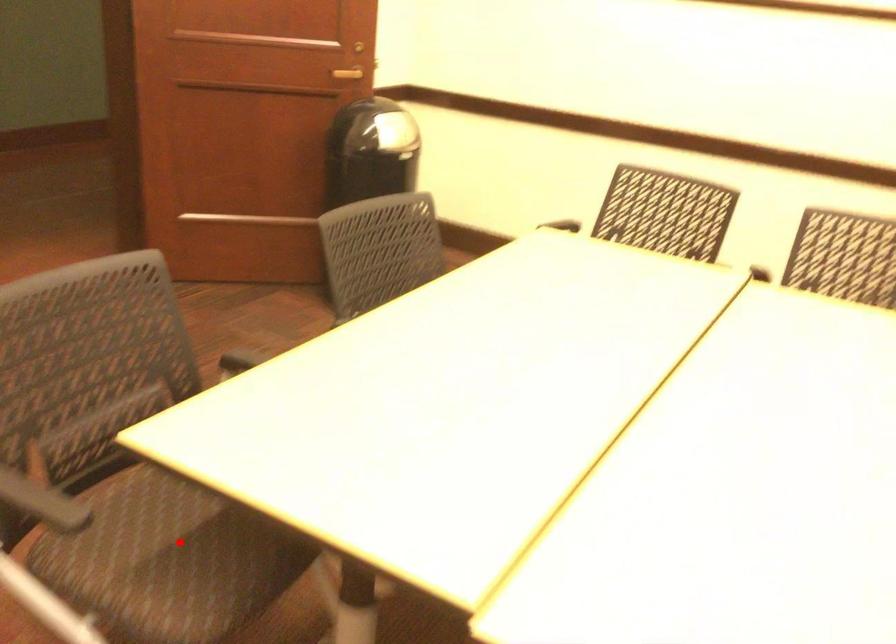
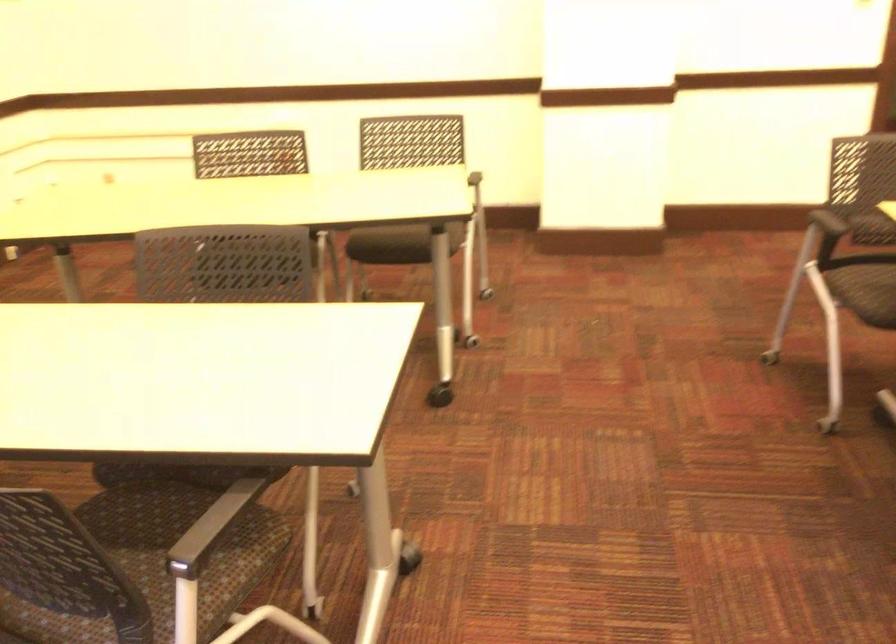
Where in the second image is the point corresponding to the highlighted location from the first image?

(872, 283)